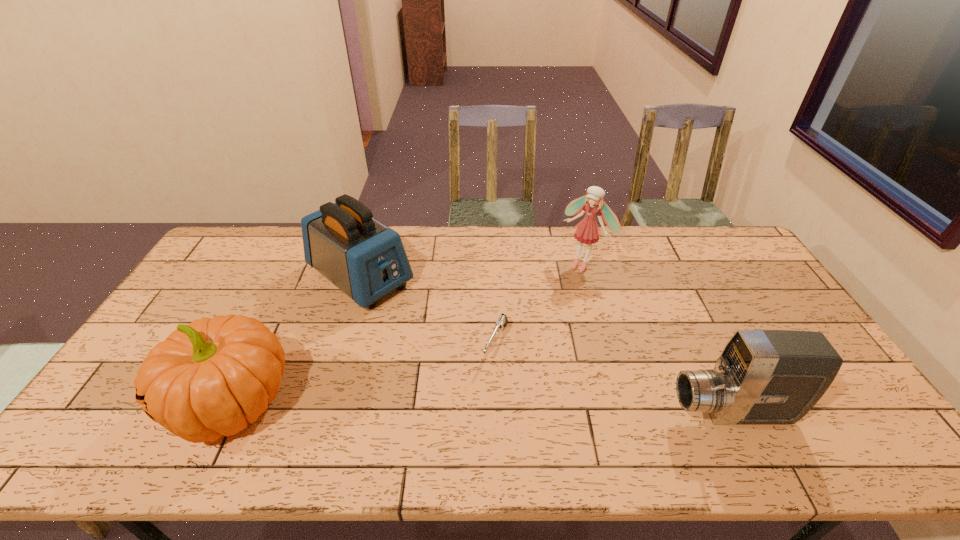
Where is `pumpkin`? pumpkin is located at coordinates (212, 377).

You are a GUI agent. You are given a task and a screenshot of the screen. Output one action in this format:
    pyautogui.click(x=<x>, y=<y>)
    Task: Click on the camcorder
    Image resolution: width=960 pixels, height=540 pixels.
    Given the screenshot: What is the action you would take?
    pyautogui.click(x=762, y=376)

Identify the location of doll. Image resolution: width=960 pixels, height=540 pixels. (587, 231).

At what (x,y) coordinates should I click in order to perform the action: click on the shortest object. Please return your answer as a coordinate pair (x, y). Image resolution: width=960 pixels, height=540 pixels. Looking at the image, I should click on (502, 321).

The height and width of the screenshot is (540, 960). Identify the location of pistol. (502, 321).

You are a GUI agent. You are given a task and a screenshot of the screen. Output one action in this format:
    pyautogui.click(x=<x>, y=<y>)
    Task: Click on the toaster
    Image resolution: width=960 pixels, height=540 pixels.
    Given the screenshot: What is the action you would take?
    pyautogui.click(x=365, y=259)

Where is `free point located on the surface of the pumpkin`? This screenshot has height=540, width=960. free point located on the surface of the pumpkin is located at coordinates (128, 404).

Identify the location of vacant space located on the surface of the pumpkin. (148, 404).

This screenshot has width=960, height=540. What are the coordinates of `free space located on the surface of the pumpkin` in the screenshot? It's located at (111, 404).

Where is `free spot located 0.390m at the front of the camcorder, highlighting the lens`? This screenshot has height=540, width=960. free spot located 0.390m at the front of the camcorder, highlighting the lens is located at coordinates (513, 413).